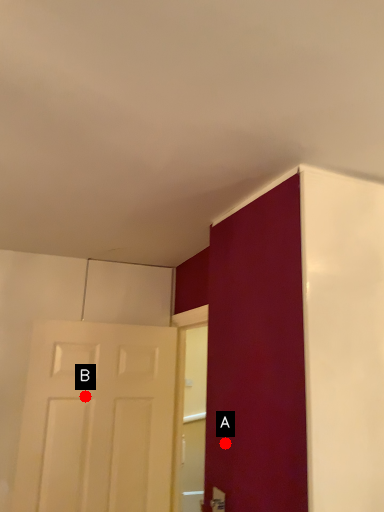
Question: Two points are circled on the image, labeled by A and B beside each circle. Among these points, which one is nearest to the camera?

Choices:
 (A) A is closer
 (B) B is closer

Answer: (A)